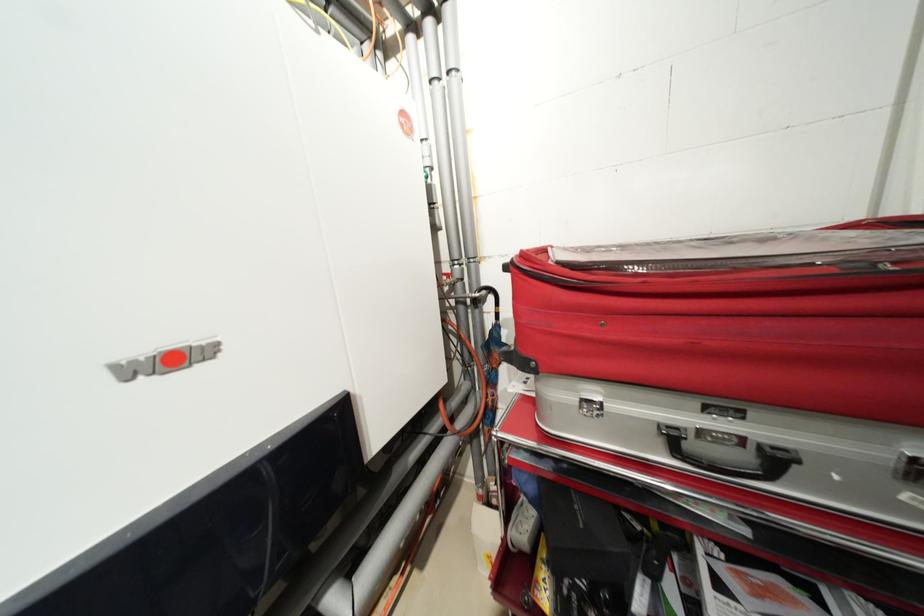
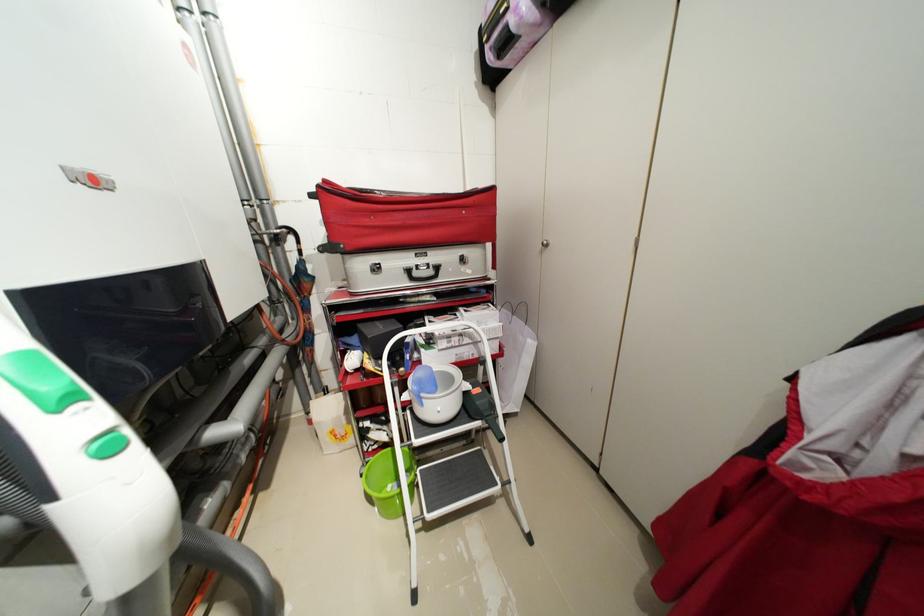
Question: The first image is from the beginning of the video and the second image is from the end. How did the camera likely rotate when shooting the video?

Choices:
 (A) Left
 (B) Right
 (C) Up
 (D) Down

Answer: (B)